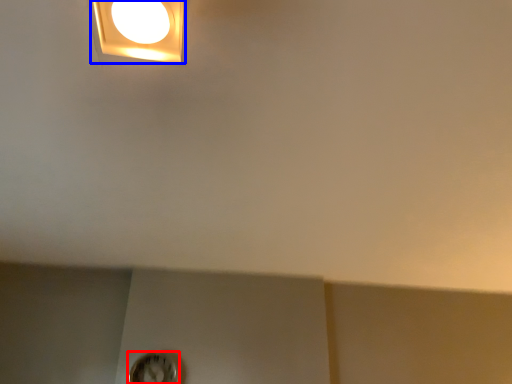
Question: Which point is closer to the camera, clock (highlighted by a red box) or lamp (highlighted by a blue box)?

Choices:
 (A) clock
 (B) lamp

Answer: (B)